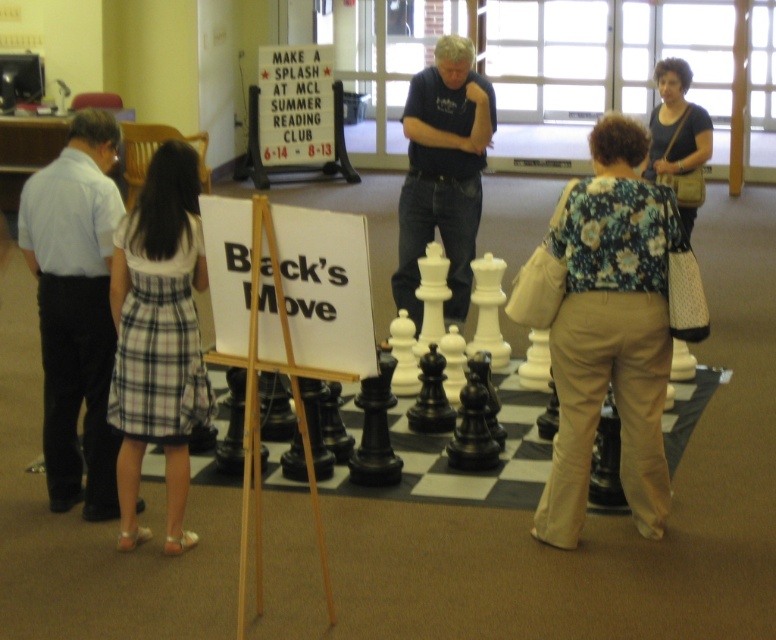
Is point (28, 240) farther from camera compared to point (123, 410)?

Yes, point (28, 240) is behind point (123, 410).

Is light blue shirt at left above plaid fabric skirt at lower left?

Correct, light blue shirt at left is located above plaid fabric skirt at lower left.

Is point (47, 490) in front of point (175, 428)?

No, it is behind (175, 428).

Identify the location of light blue shirt at left. This screenshot has height=640, width=776. (75, 308).

Between floral fabric blouse at center and light blue shirt at left, which one appears on the left side from the viewer's perspective?

light blue shirt at left is more to the left.

Is point (563, 385) behind point (120, 211)?

No.

Locate an element on the screen. floral fabric blouse at center is located at coordinates (611, 332).

Who is more forward, (468, 202) or (686, 134)?

Positioned in front is point (468, 202).

Which is more to the right, dark blue shirt at center or matte brown purse at upper right?

matte brown purse at upper right is more to the right.

Between point (423, 115) and point (670, 120), which one is positioned in front?

Point (423, 115) is more forward.

You are a GUI agent. You are given a task and a screenshot of the screen. Output one action in this format:
    pyautogui.click(x=<x>, y=<y>)
    Task: Click on the dark blue shirt at center
    This screenshot has width=776, height=640.
    Given the screenshot: What is the action you would take?
    pyautogui.click(x=442, y=173)